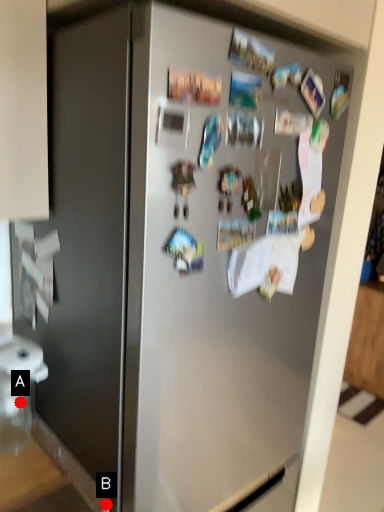
Question: Two points are circled on the image, labeled by A and B beside each circle. Among these points, which one is nearest to the camera?

Choices:
 (A) A is closer
 (B) B is closer

Answer: (B)